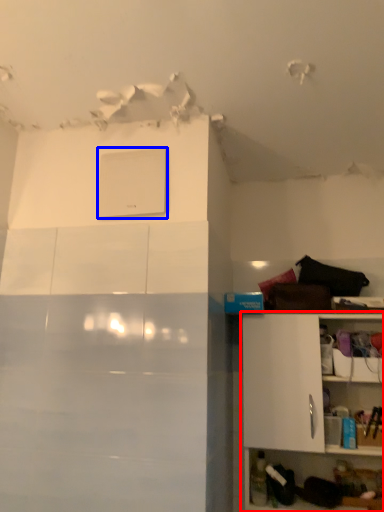
Question: Which point is further to the camera, shelf (highlighted by a red box) or appliance (highlighted by a blue box)?

Choices:
 (A) shelf
 (B) appliance

Answer: (B)